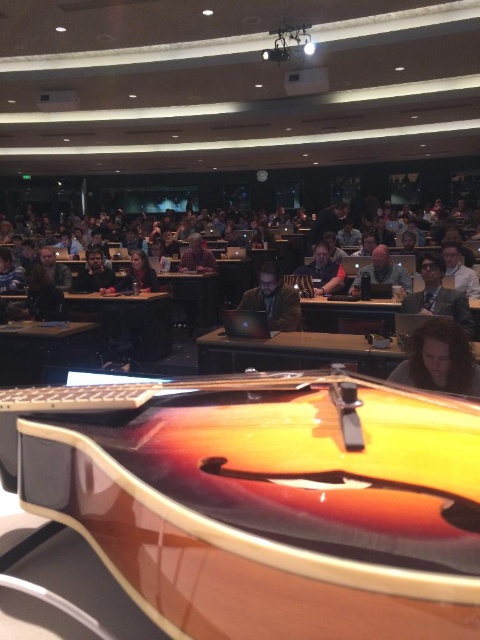
You are a photographer standing in the back of the lecture hall. You want to take a photo of the matte black glasses at upper right and the matte black laptop at center so that both are in focus. The camera you are using has a depth of field that can cover objects within a 10 feet range. Can you capture both objects in focus without adjusting your camera position?

The matte black glasses at upper right and matte black laptop at center are 10.91 feet apart. Since the depth of field can only cover 10 feet, the distance between them exceeds the camera s capability. Therefore, you cannot capture both objects in focus without adjusting your camera position.

You are an attendee in the lecture hall and notice both the matte brown jacket at center and the matte black laptop at center. Which object is closer to you?

The matte brown jacket at center is closer to you because it is in front of the matte black laptop at center.

You are a photographer in the lecture hall and want to capture both the matte black glasses at upper right and the matte black laptop at center in a single shot. Based on their positions, will the glasses appear above or below the laptop in the photo?

The matte black glasses at upper right is positioned under the matte black laptop at center, so in the photo, the glasses will appear below the laptop.